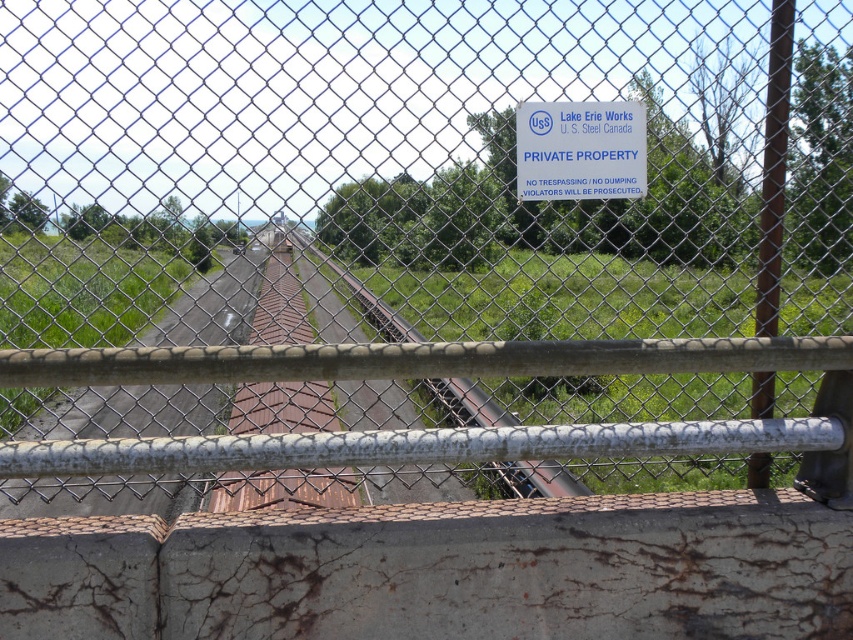
You are a maintenance worker trying to locate the brown corrugated metal train track at center. From your current position, which direction should you look relative to the blue plastic sign at upper center?

The brown corrugated metal train track at center is below the blue plastic sign at upper center, so you should look downward from the blue plastic sign at upper center to find it.

You are standing at the base of the chainlink fence and want to locate the blue plastic sign at upper center. According to the coordinates provided, where should you look relative to your position?

The blue plastic sign at upper center is located at coordinates point (579,148), which means it is positioned to the right and slightly above your current viewpoint from the base of the chainlink fence.